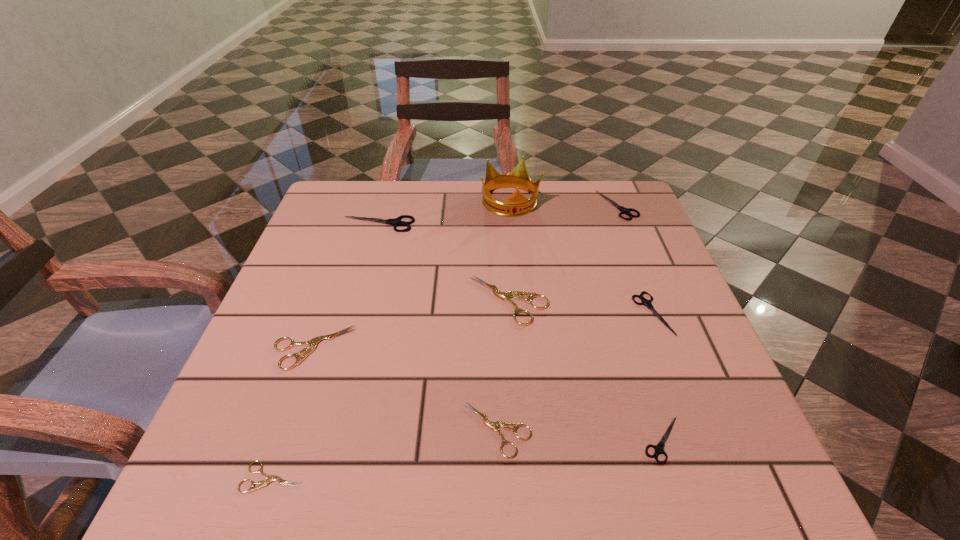
Image resolution: width=960 pixels, height=540 pixels. Find the location of `free space that is in between the biggest black shears and the second nearest black shears`. free space that is in between the biggest black shears and the second nearest black shears is located at coordinates (516, 268).

The height and width of the screenshot is (540, 960). In order to click on the closest object relative to the second biggest beige shears in this screenshot , I will do `click(269, 478)`.

Identify the location of object that is the seventh closest one to the biggest black shears. This screenshot has width=960, height=540. (269, 478).

Where is `shears that is the fourth closest one to the shortest object`? The width and height of the screenshot is (960, 540). shears that is the fourth closest one to the shortest object is located at coordinates point(659,448).

The image size is (960, 540). I want to click on the second closest shears to the biggest beige shears, so click(644, 301).

The height and width of the screenshot is (540, 960). Identify the location of black shears that stands as the third closest to the eighth shortest object. (659, 448).

Locate which black shears is the fourth closest to the shortest object. Please provide its 2D coordinates. Your answer should be formatted as a tuple, i.e. [(x, y)], where the tuple contains the x and y coordinates of a point satisfying the conditions above.

[(623, 210)]

Choose which beige shears is the second nearest neighbor to the third farthest beige shears. Please provide its 2D coordinates. Your answer should be formatted as a tuple, i.e. [(x, y)], where the tuple contains the x and y coordinates of a point satisfying the conditions above.

[(312, 343)]

Identify which beige shears is the second nearest to the gold crown. Please provide its 2D coordinates. Your answer should be formatted as a tuple, i.e. [(x, y)], where the tuple contains the x and y coordinates of a point satisfying the conditions above.

[(312, 343)]

Find the location of a particular element. free location that satisfies the following two spatial constraints: 1. on the back side of the biggest beige shears; 2. on the right side of the second smallest beige shears is located at coordinates (492, 300).